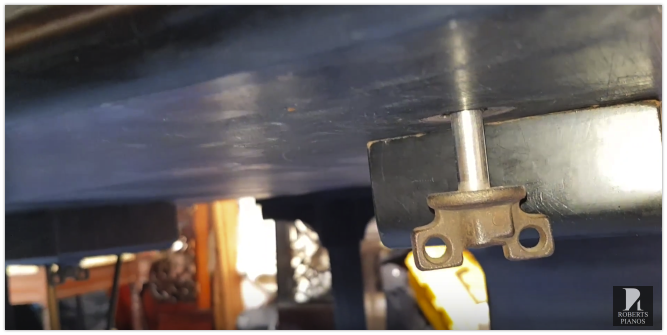
Image resolution: width=667 pixels, height=335 pixels. In order to click on light in this screenshot , I will do `click(255, 240)`.